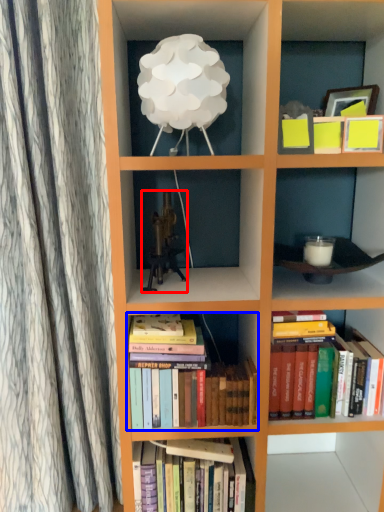
Question: Which object is closer to the camera taking this photo, toy (highlighted by a red box) or book (highlighted by a blue box)?

Choices:
 (A) toy
 (B) book

Answer: (B)